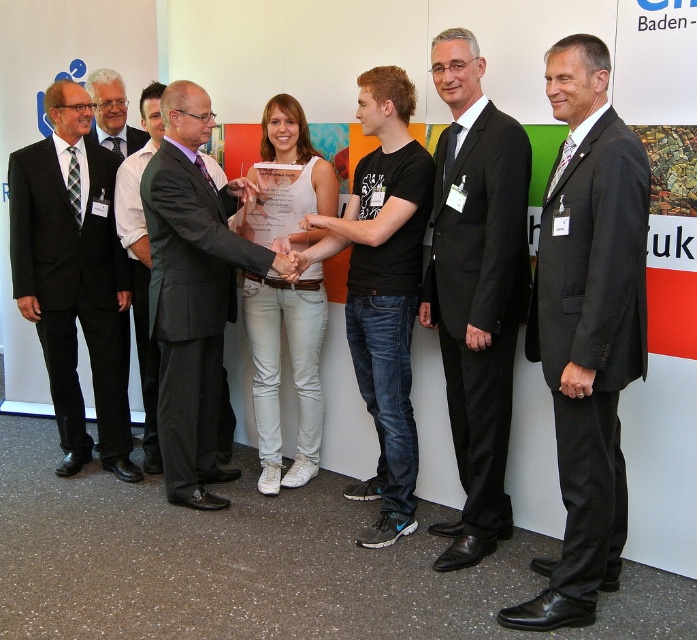
Question: Is black suit at right to the right of matte black suit at center from the viewer's perspective?

Choices:
 (A) no
 (B) yes

Answer: (B)

Question: Which is nearer to the dark gray suit at center?

Choices:
 (A) matte black suit at center
 (B) black suit at right
 (C) dark gray suit at left
 (D) black suit at center

Answer: (C)

Question: Can you confirm if black suit at right is positioned to the right of matte black suit at center?

Choices:
 (A) yes
 (B) no

Answer: (A)

Question: Among these points, which one is nearest to the camera?

Choices:
 (A) (109, 134)
 (B) (187, 481)
 (C) (66, 397)

Answer: (B)

Question: Does black suit at right have a larger size compared to dark gray suit at left?

Choices:
 (A) yes
 (B) no

Answer: (A)

Question: Which point appears farthest from the camera in this image?

Choices:
 (A) (98, 74)
 (B) (190, 460)
 (C) (61, 330)
 (D) (530, 310)

Answer: (A)